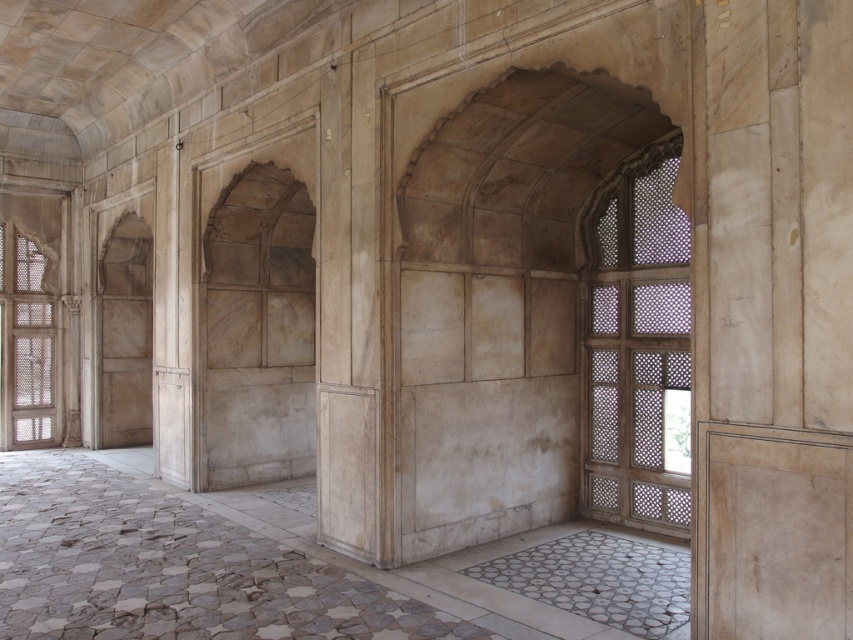
Locate an element on the screen. translucent wood lattice at right is located at coordinates (637, 349).

Which is more to the right, translucent wood lattice at right or matte wood window at left?

translucent wood lattice at right is more to the right.

Where is `translucent wood lattice at right`? translucent wood lattice at right is located at coordinates (637, 349).

Image resolution: width=853 pixels, height=640 pixels. What are the coordinates of `translucent wood lattice at right` in the screenshot? It's located at (637, 349).